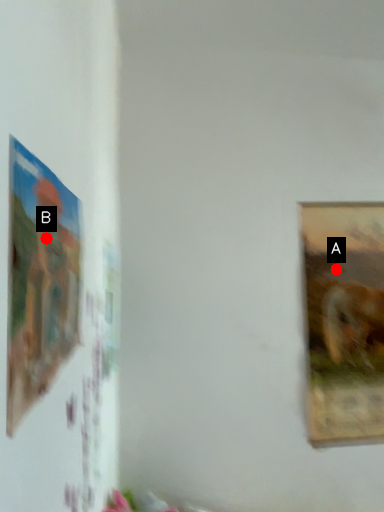
Question: Two points are circled on the image, labeled by A and B beside each circle. Which point is farther to the camera?

Choices:
 (A) A is further
 (B) B is further

Answer: (A)